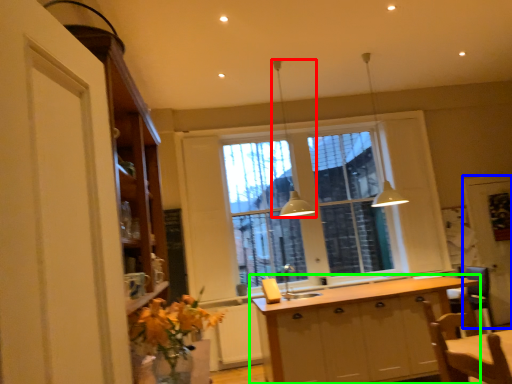
Question: Estimate the real-world distances between objects in this image. Which object is closer to light fixture (highlighted by a red box), screen door (highlighted by a blue box) or cabinetry (highlighted by a green box)?

Choices:
 (A) screen door
 (B) cabinetry

Answer: (B)